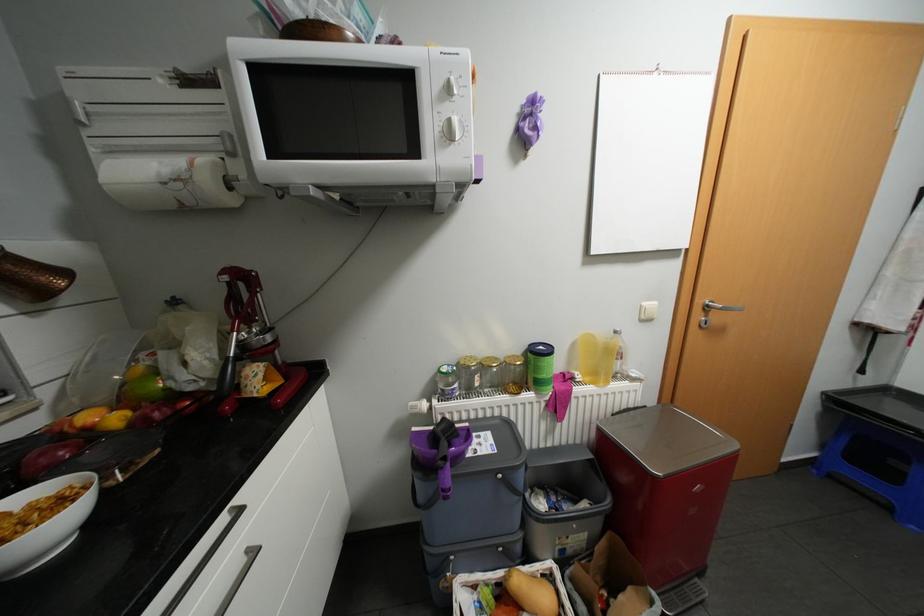
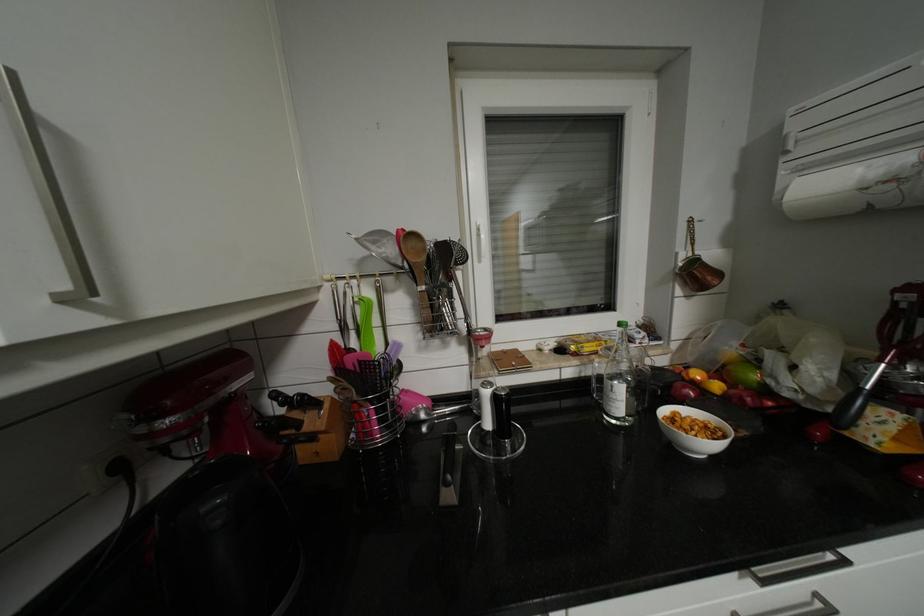
In the second image, find the point that corresponds to point (123, 418) in the first image.

(724, 386)